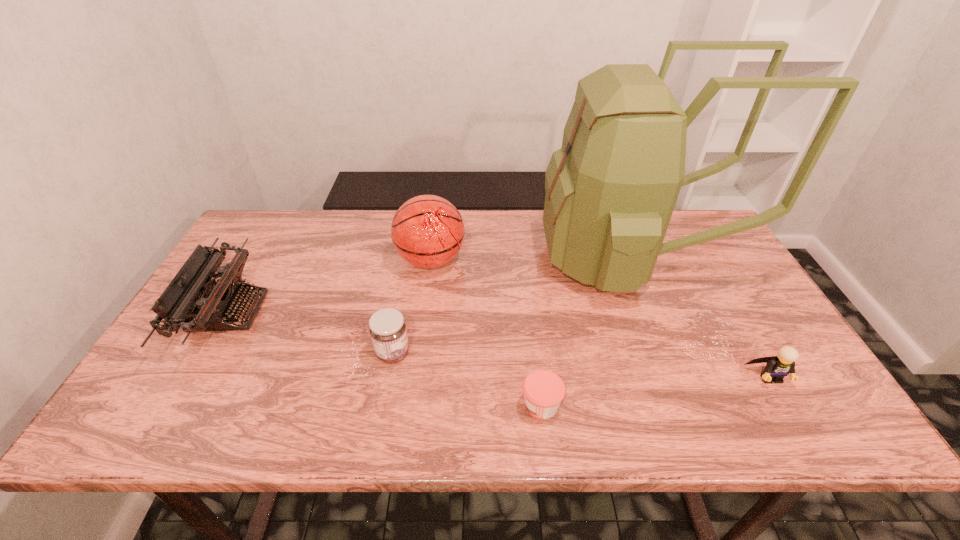
Choose which object is the fourth nearest neighbor to the farther jam. Please provide its 2D coordinates. Your answer should be formatted as a tuple, i.e. [(x, y)], where the tuple contains the x and y coordinates of a point satisfying the conditions above.

[(611, 189)]